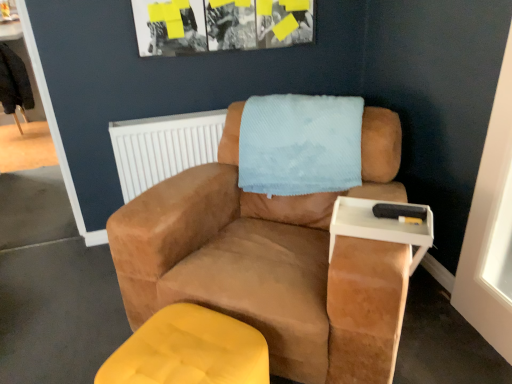
Question: From a real-world perspective, is matte yellow ottoman at lower left located higher than white plastic radiator at upper center?

Choices:
 (A) no
 (B) yes

Answer: (A)

Question: Is matte yellow ottoman at lower left further to camera compared to white plastic radiator at upper center?

Choices:
 (A) yes
 (B) no

Answer: (B)

Question: From the image's perspective, is matte yellow ottoman at lower left on white plastic radiator at upper center?

Choices:
 (A) yes
 (B) no

Answer: (B)

Question: Could you tell me if matte yellow ottoman at lower left is facing white plastic radiator at upper center?

Choices:
 (A) no
 (B) yes

Answer: (A)

Question: Considering the relative sizes of matte yellow ottoman at lower left and white plastic radiator at upper center in the image provided, is matte yellow ottoman at lower left bigger than white plastic radiator at upper center?

Choices:
 (A) no
 (B) yes

Answer: (B)

Question: Is point (198, 180) positioned closer to the camera than point (228, 354)?

Choices:
 (A) closer
 (B) farther

Answer: (B)

Question: In the image, is suede brown armchair at center positioned in front of or behind matte yellow ottoman at lower left?

Choices:
 (A) front
 (B) behind

Answer: (B)

Question: From a real-world perspective, is suede brown armchair at center positioned above or below matte yellow ottoman at lower left?

Choices:
 (A) below
 (B) above

Answer: (B)

Question: Is suede brown armchair at center wider or thinner than matte yellow ottoman at lower left?

Choices:
 (A) thin
 (B) wide

Answer: (B)

Question: From the image's perspective, relative to matte yellow ottoman at lower left, is white plastic radiator at upper center above or below?

Choices:
 (A) above
 (B) below

Answer: (A)

Question: Is white plastic radiator at upper center bigger or smaller than matte yellow ottoman at lower left?

Choices:
 (A) small
 (B) big

Answer: (A)

Question: In the image, is white plastic radiator at upper center positioned in front of or behind matte yellow ottoman at lower left?

Choices:
 (A) front
 (B) behind

Answer: (B)

Question: In terms of height, does white plastic radiator at upper center look taller or shorter compared to matte yellow ottoman at lower left?

Choices:
 (A) short
 (B) tall

Answer: (B)

Question: Considering the positions of white plastic tray at right and suede brown armchair at center in the image, is white plastic tray at right bigger or smaller than suede brown armchair at center?

Choices:
 (A) small
 (B) big

Answer: (A)

Question: Does point (388, 203) appear closer or farther from the camera than point (343, 309)?

Choices:
 (A) farther
 (B) closer

Answer: (A)